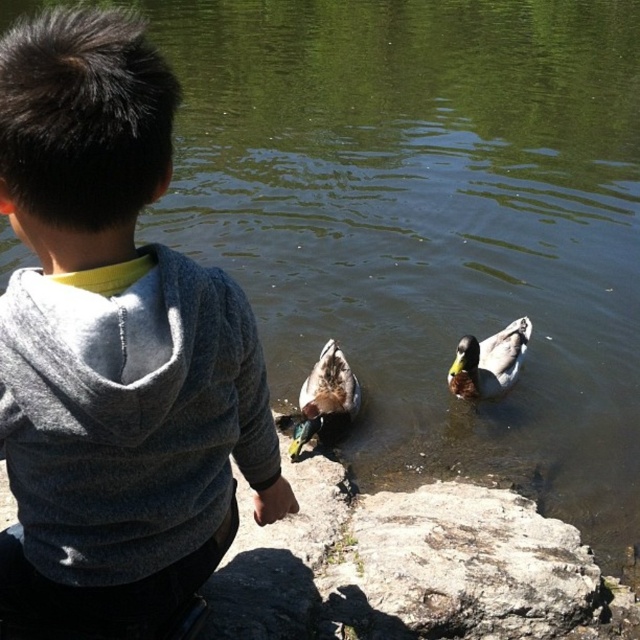
Question: Can you confirm if gray hoodie at center is wider than green glossy duck at center?

Choices:
 (A) yes
 (B) no

Answer: (A)

Question: Can you confirm if gray hoodie at center is thinner than greenish-gray feathers duck at right?

Choices:
 (A) yes
 (B) no

Answer: (B)

Question: Considering the real-world distances, which object is farthest from the greenish-gray feathers duck at right?

Choices:
 (A) green glossy duck at center
 (B) gray rough rock at center
 (C) gray hoodie at center

Answer: (C)

Question: Does gray rough rock at center lie behind green glossy duck at center?

Choices:
 (A) yes
 (B) no

Answer: (B)

Question: Which point appears closest to the camera in this image?

Choices:
 (A) (456, 570)
 (B) (332, 364)
 (C) (518, 337)

Answer: (A)

Question: Which object appears closest to the camera in this image?

Choices:
 (A) gray rough rock at center
 (B) greenish-gray feathers duck at right
 (C) gray hoodie at center
 (D) green glossy duck at center

Answer: (C)